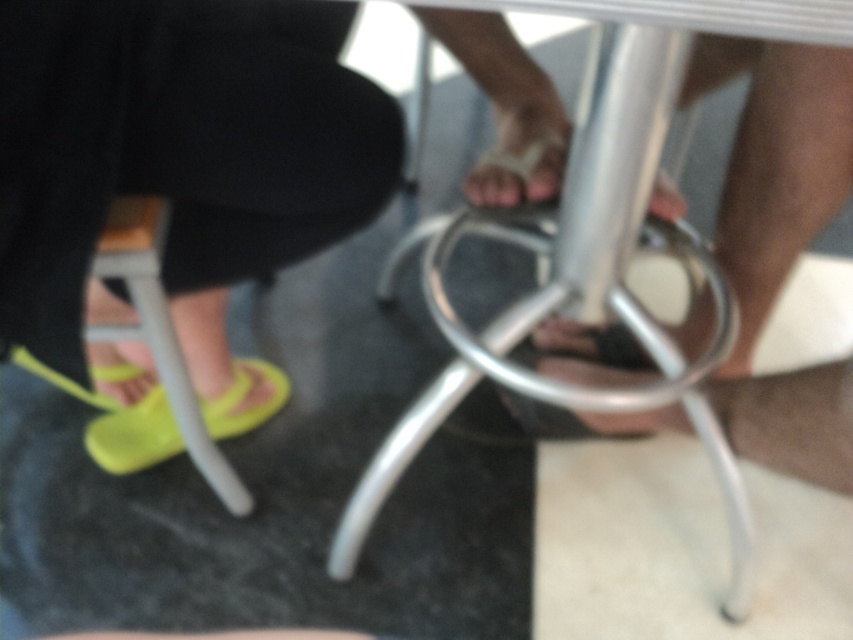
Does point (103, 333) come behind point (180, 449)?

No, it is not.

What do you see at coordinates (160, 332) in the screenshot? The width and height of the screenshot is (853, 640). I see `wooden seat at lower left` at bounding box center [160, 332].

You are a GUI agent. You are given a task and a screenshot of the screen. Output one action in this format:
    pyautogui.click(x=<x>, y=<y>)
    Task: Click on the wooden seat at lower left
    The height and width of the screenshot is (640, 853).
    Given the screenshot: What is the action you would take?
    pyautogui.click(x=160, y=332)